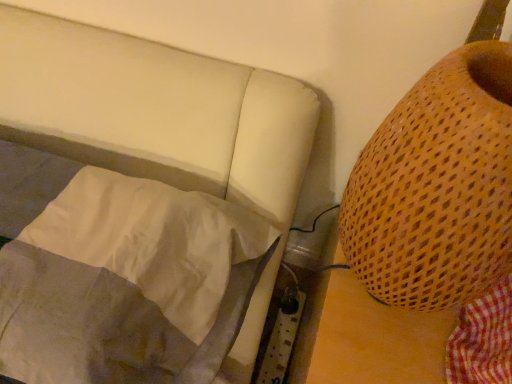
The width and height of the screenshot is (512, 384). Describe the element at coordinates (139, 205) in the screenshot. I see `white fabric bed at upper left` at that location.

Identify the location of white fabric bed at upper left. This screenshot has width=512, height=384. (139, 205).

Measure the distance between point (187, 228) and camera.

Point (187, 228) is 26.81 inches away from camera.

I want to click on white fabric bed at upper left, so click(139, 205).